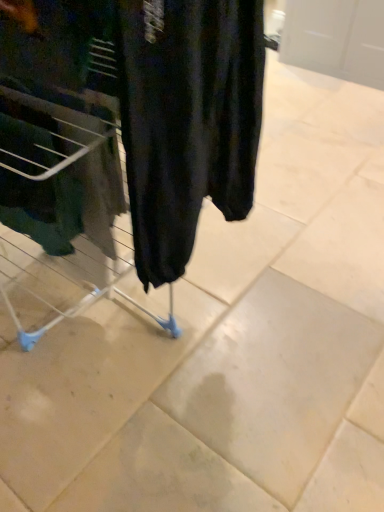
I want to click on black matte pants at center, so click(x=187, y=120).

Describe the element at coordinates (187, 120) in the screenshot. I see `black matte pants at center` at that location.

The width and height of the screenshot is (384, 512). What are the coordinates of `metal laundry basket at left` in the screenshot? It's located at (65, 201).

The image size is (384, 512). What do you see at coordinates (65, 201) in the screenshot? I see `metal laundry basket at left` at bounding box center [65, 201].

Image resolution: width=384 pixels, height=512 pixels. I want to click on black matte pants at center, so click(x=187, y=120).

Which object is positioned more to the right, metal laundry basket at left or black matte pants at center?

black matte pants at center is more to the right.

In the image, is metal laundry basket at left positioned in front of or behind black matte pants at center?

Visually, metal laundry basket at left is located behind black matte pants at center.

Between point (77, 204) and point (216, 135), which one is positioned behind?

Positioned behind is point (216, 135).

From the image's perspective, is metal laundry basket at left on top of black matte pants at center?

No.

From a real-world perspective, who is located lower, metal laundry basket at left or black matte pants at center?

In real-world perspective, metal laundry basket at left is lower.

Which of these two, metal laundry basket at left or black matte pants at center, is wider?

metal laundry basket at left.

From their relative heights in the image, would you say metal laundry basket at left is taller or shorter than black matte pants at center?

Clearly, metal laundry basket at left is shorter compared to black matte pants at center.

In terms of size, does metal laundry basket at left appear bigger or smaller than black matte pants at center?

Considering their sizes, metal laundry basket at left takes up less space than black matte pants at center.

Can black matte pants at center be found inside metal laundry basket at left?

No, metal laundry basket at left does not contain black matte pants at center.

Is metal laundry basket at left positioned far away from black matte pants at center?

No.

Looking at this image, is black matte pants at center at the back of metal laundry basket at left?

metal laundry basket at left is not turned away from black matte pants at center.

What's the angular difference between metal laundry basket at left and black matte pants at center's facing directions?

metal laundry basket at left and black matte pants at center are facing 88.9 degrees away from each other.

At what (x,y) coordinates should I click in order to perform the action: click on clothing on the right of the metal laundry basket at left. Please return your answer as a coordinate pair (x, y). The image size is (384, 512). Looking at the image, I should click on (187, 120).

Which object is positioned more to the right, black matte pants at center or metal laundry basket at left?

black matte pants at center is more to the right.

Which object is closer to the camera, black matte pants at center or metal laundry basket at left?

black matte pants at center is in front.

Does point (214, 178) appear closer or farther from the camera than point (63, 232)?

Point (214, 178) is positioned farther from the camera compared to point (63, 232).

From the image's perspective, between black matte pants at center and metal laundry basket at left, which one is located above?

black matte pants at center is shown above in the image.

From a real-world perspective, between black matte pants at center and metal laundry basket at left, who is vertically lower?

metal laundry basket at left is physically lower.

Considering the relative sizes of black matte pants at center and metal laundry basket at left in the image provided, is black matte pants at center thinner than metal laundry basket at left?

Correct, the width of black matte pants at center is less than that of metal laundry basket at left.

Considering the relative sizes of black matte pants at center and metal laundry basket at left in the image provided, is black matte pants at center shorter than metal laundry basket at left?

In fact, black matte pants at center may be taller than metal laundry basket at left.

Does black matte pants at center have a smaller size compared to metal laundry basket at left?

Incorrect, black matte pants at center is not smaller in size than metal laundry basket at left.

Choose the correct answer: Is black matte pants at center inside metal laundry basket at left or outside it?

black matte pants at center is located beyond the bounds of metal laundry basket at left.

Is black matte pants at center beside metal laundry basket at left?

No, black matte pants at center is not beside metal laundry basket at left.

Is black matte pants at center facing towards metal laundry basket at left?

No, black matte pants at center is not oriented towards metal laundry basket at left.

How distant is black matte pants at center from metal laundry basket at left?

A distance of 10.70 inches exists between black matte pants at center and metal laundry basket at left.

Where is `furniture below the black matte pants at center (from the image's perspective)`? furniture below the black matte pants at center (from the image's perspective) is located at coordinates tap(65, 201).

Locate an element on the screen. Image resolution: width=384 pixels, height=512 pixels. furniture that appears behind the black matte pants at center is located at coordinates (65, 201).

Image resolution: width=384 pixels, height=512 pixels. In the image, there is a metal laundry basket at left. Identify the location of clothing above it (from the image's perspective). (187, 120).